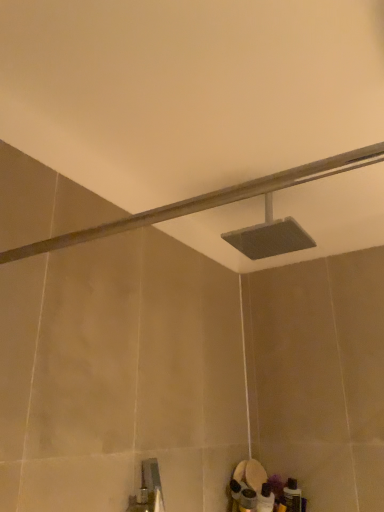
Describe the element at coordinates (270, 236) in the screenshot. This screenshot has width=384, height=512. I see `matte gray showerhead at center, the 2th shower when ordered from front to back` at that location.

What is the approximate height of matte gray showerhead at center, which is the first shower from back to front?

It is 7.84 inches.

Find the location of `matte gray showerhead at center, the 2th shower when ordered from front to back`. matte gray showerhead at center, the 2th shower when ordered from front to back is located at coordinates (270, 236).

Image resolution: width=384 pixels, height=512 pixels. What do you see at coordinates (208, 200) in the screenshot?
I see `matte gray showerhead at upper center, the 1th shower viewed from the front` at bounding box center [208, 200].

The width and height of the screenshot is (384, 512). In order to click on matte gray showerhead at upper center, the 1th shower viewed from the front in this screenshot , I will do `click(208, 200)`.

Image resolution: width=384 pixels, height=512 pixels. I want to click on matte gray showerhead at center, the 2th shower when ordered from front to back, so click(x=270, y=236).

Between matte gray showerhead at center, the 2th shower when ordered from front to back, and matte gray showerhead at upper center, the 1th shower viewed from the front, which one appears on the right side from the viewer's perspective?

matte gray showerhead at center, the 2th shower when ordered from front to back.

Which object is more forward, matte gray showerhead at center, the 2th shower when ordered from front to back, or matte gray showerhead at upper center, the 1th shower viewed from the front?

matte gray showerhead at upper center, the 1th shower viewed from the front, is in front.

Considering the positions of point (279, 228) and point (323, 164), is point (279, 228) closer or farther from the camera than point (323, 164)?

Clearly, point (279, 228) is more distant from the camera than point (323, 164).

From the image's perspective, is matte gray showerhead at center, the 2th shower when ordered from front to back, above or below matte gray showerhead at upper center, the 1th shower viewed from the front?

Clearly, from the image's perspective, matte gray showerhead at center, the 2th shower when ordered from front to back, is above matte gray showerhead at upper center, the 1th shower viewed from the front.

Consider the image. From a real-world perspective, which object rests below the other?

matte gray showerhead at upper center, the 1th shower viewed from the front, from a real-world perspective.

Considering the relative sizes of matte gray showerhead at center, the 2th shower when ordered from front to back, and matte gray showerhead at upper center, which is the second shower from back to front, in the image provided, is matte gray showerhead at center, the 2th shower when ordered from front to back, wider than matte gray showerhead at upper center, which is the second shower from back to front,?

In fact, matte gray showerhead at center, the 2th shower when ordered from front to back, might be narrower than matte gray showerhead at upper center, which is the second shower from back to front.

Considering the sizes of matte gray showerhead at center, which is the first shower from back to front, and matte gray showerhead at upper center, the 1th shower viewed from the front, in the image, is matte gray showerhead at center, which is the first shower from back to front, taller or shorter than matte gray showerhead at upper center, the 1th shower viewed from the front,?

In the image, matte gray showerhead at center, which is the first shower from back to front, appears to be taller than matte gray showerhead at upper center, the 1th shower viewed from the front.

Does matte gray showerhead at center, which is the first shower from back to front, have a smaller size compared to matte gray showerhead at upper center, the 1th shower viewed from the front?

Incorrect, matte gray showerhead at center, which is the first shower from back to front, is not smaller in size than matte gray showerhead at upper center, the 1th shower viewed from the front.

From the picture: Is matte gray showerhead at center, which is the first shower from back to front, positioned beyond the bounds of matte gray showerhead at upper center, which is the second shower from back to front?

Yes, matte gray showerhead at center, which is the first shower from back to front, is outside of matte gray showerhead at upper center, which is the second shower from back to front.

Are matte gray showerhead at center, the 2th shower when ordered from front to back, and matte gray showerhead at upper center, the 1th shower viewed from the front, located far from each other?

matte gray showerhead at center, the 2th shower when ordered from front to back, is near matte gray showerhead at upper center, the 1th shower viewed from the front, not far away.

Is matte gray showerhead at center, the 2th shower when ordered from front to back, positioned with its back to matte gray showerhead at upper center, which is the second shower from back to front?

No, matte gray showerhead at center, the 2th shower when ordered from front to back,'s orientation is not away from matte gray showerhead at upper center, which is the second shower from back to front.

What's the angular difference between matte gray showerhead at center, which is the first shower from back to front, and matte gray showerhead at upper center, the 1th shower viewed from the front,'s facing directions?

The facing directions of matte gray showerhead at center, which is the first shower from back to front, and matte gray showerhead at upper center, the 1th shower viewed from the front, are 0.000139 degrees apart.

Locate an element on the screen. shower on the left of matte gray showerhead at center, which is the first shower from back to front is located at coordinates (208, 200).

Which object is positioned more to the right, matte gray showerhead at upper center, the 1th shower viewed from the front, or matte gray showerhead at center, which is the first shower from back to front?

Positioned to the right is matte gray showerhead at center, which is the first shower from back to front.

Considering their positions, is matte gray showerhead at upper center, the 1th shower viewed from the front, located in front of or behind matte gray showerhead at center, which is the first shower from back to front?

matte gray showerhead at upper center, the 1th shower viewed from the front, is in front of matte gray showerhead at center, which is the first shower from back to front.

Does point (50, 249) lie behind point (286, 252)?

No, (50, 249) is closer to viewer.

From the image's perspective, is matte gray showerhead at upper center, the 1th shower viewed from the front, on top of matte gray showerhead at center, which is the first shower from back to front?

No, from the image's perspective, matte gray showerhead at upper center, the 1th shower viewed from the front, is not over matte gray showerhead at center, which is the first shower from back to front.

From a real-world perspective, which object stands above the other?

matte gray showerhead at center, which is the first shower from back to front, from a real-world perspective.

Can you confirm if matte gray showerhead at upper center, the 1th shower viewed from the front, is wider than matte gray showerhead at center, the 2th shower when ordered from front to back?

Yes, matte gray showerhead at upper center, the 1th shower viewed from the front, is wider than matte gray showerhead at center, the 2th shower when ordered from front to back.

Who is taller, matte gray showerhead at upper center, which is the second shower from back to front, or matte gray showerhead at center, which is the first shower from back to front?

matte gray showerhead at center, which is the first shower from back to front, is taller.

In terms of size, does matte gray showerhead at upper center, which is the second shower from back to front, appear bigger or smaller than matte gray showerhead at center, the 2th shower when ordered from front to back?

matte gray showerhead at upper center, which is the second shower from back to front, is smaller than matte gray showerhead at center, the 2th shower when ordered from front to back.

Do you think matte gray showerhead at upper center, which is the second shower from back to front, is within matte gray showerhead at center, which is the first shower from back to front, or outside of it?

matte gray showerhead at upper center, which is the second shower from back to front, is outside matte gray showerhead at center, which is the first shower from back to front.

Is matte gray showerhead at upper center, which is the second shower from back to front, positioned far away from matte gray showerhead at center, which is the first shower from back to front?

No, matte gray showerhead at upper center, which is the second shower from back to front, is not far from matte gray showerhead at center, which is the first shower from back to front.

Is matte gray showerhead at upper center, the 1th shower viewed from the front, aimed at matte gray showerhead at center, the 2th shower when ordered from front to back?

No, matte gray showerhead at upper center, the 1th shower viewed from the front, is not oriented towards matte gray showerhead at center, the 2th shower when ordered from front to back.

In the image, there is a matte gray showerhead at center, which is the first shower from back to front. Where is `shower below it (from a real-world perspective)`? shower below it (from a real-world perspective) is located at coordinates (208, 200).

Where is `shower located on the left of matte gray showerhead at center, the 2th shower when ordered from front to back`? This screenshot has height=512, width=384. shower located on the left of matte gray showerhead at center, the 2th shower when ordered from front to back is located at coordinates (208, 200).

Locate an element on the screen. The height and width of the screenshot is (512, 384). shower behind the matte gray showerhead at upper center, the 1th shower viewed from the front is located at coordinates (270, 236).